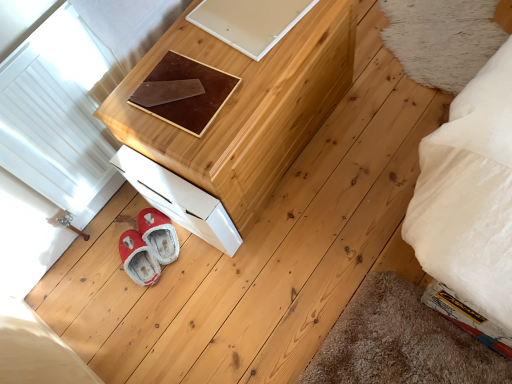
What are the coordinates of `vacant space underneath brown leather pad at center (from a real-world perspective)` in the screenshot? It's located at (181, 88).